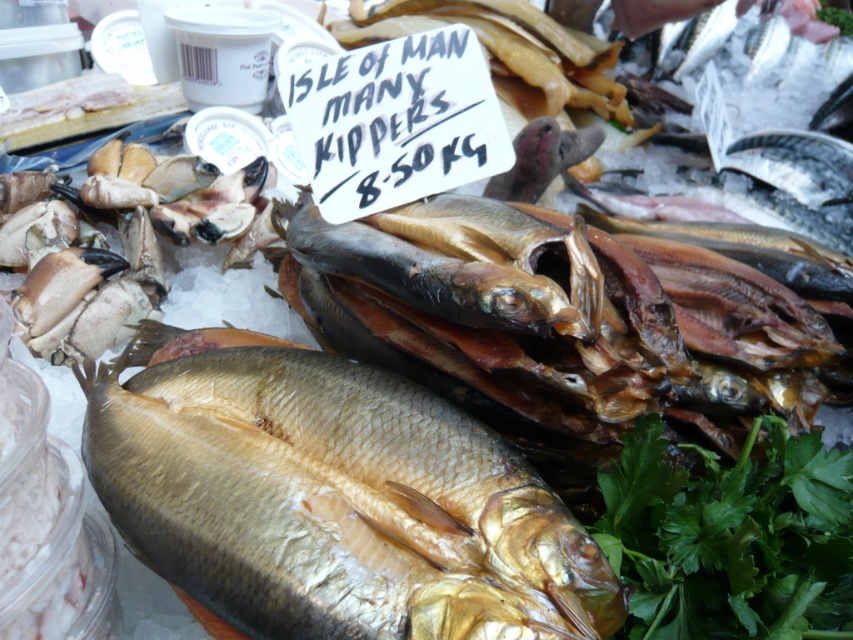
The scene shows a market stall with various seafood items. You are standing at the center of the stall and notice a point marked at coordinates (335, 502). What object is located at this point?

The point at coordinates (335, 502) marks the location of the shiny golden fish at center.

You are a customer at the market stall and want to buy the shiny golden fish at center and the green leafy parsley at lower right. If you place both items in your basket, which item will be closer to the basket handle located on the right side?

The green leafy parsley at lower right will be closer to the basket handle on the right side because the shiny golden fish at center is positioned on the left side of the green leafy parsley at lower right.

You are a chef preparing a dish and need to know the size of the ingredients. Which object in the scene is wider, the shiny golden fish at center or the green leafy parsley at lower right?

The shiny golden fish at center is wider than the green leafy parsley at lower right.